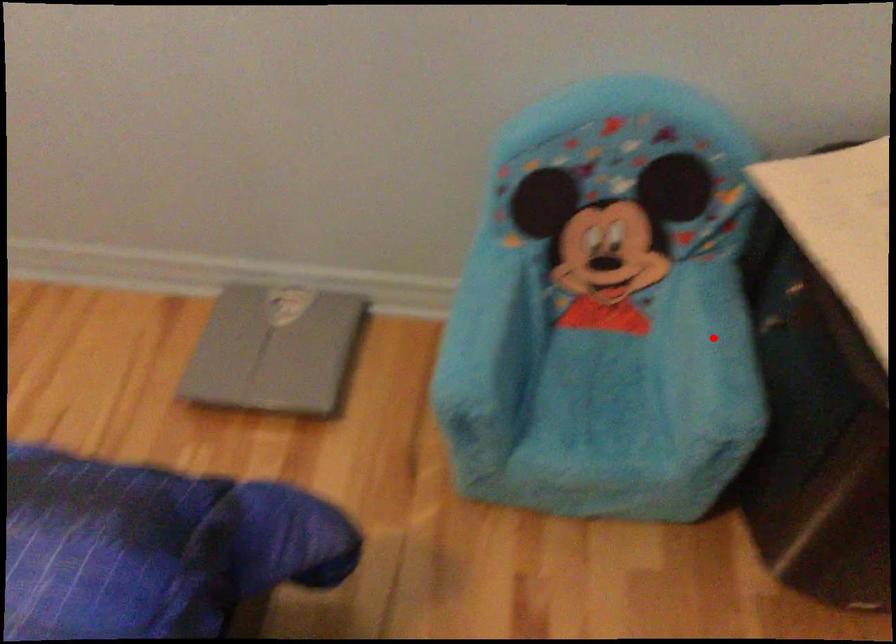
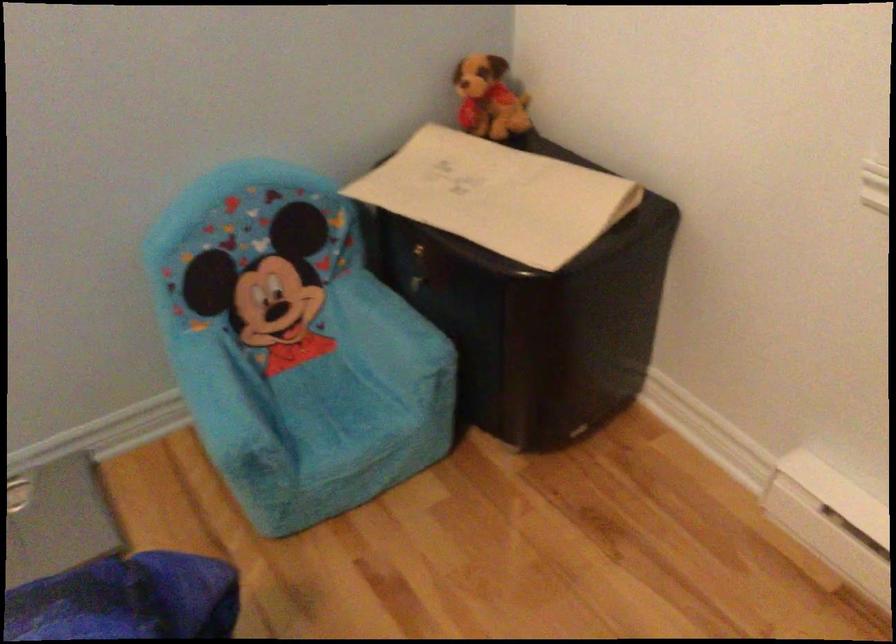
Question: I am providing you with two images of the same scene from different viewpoints. Image1 has a red point marked. In image2, the corresponding 3D location appears at what relative position? Reply with the corresponding letter.

Choices:
 (A) Closer
 (B) Farther

Answer: (B)